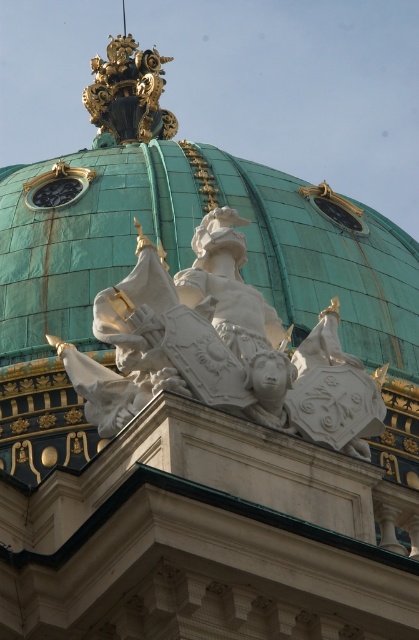
Question: Which object is farther from the camera taking this photo?

Choices:
 (A) white stone statue at center
 (B) green copper dome at center
 (C) gold metallic clock at upper center

Answer: (C)

Question: Does green copper dome at center appear on the right side of gold metallic clock at upper center?

Choices:
 (A) yes
 (B) no

Answer: (A)

Question: Can you confirm if green copper dome at center is positioned above gold metallic clock at upper center?

Choices:
 (A) no
 (B) yes

Answer: (A)

Question: In this image, where is green copper dome at center located relative to white stone statue at center?

Choices:
 (A) above
 (B) below

Answer: (A)

Question: Estimate the real-world distances between objects in this image. Which object is farther from the gold metallic clock at upper center?

Choices:
 (A) white stone statue at center
 (B) green copper dome at center

Answer: (A)

Question: Which point appears closest to the camera in this image?

Choices:
 (A) (92, 186)
 (B) (46, 196)

Answer: (A)